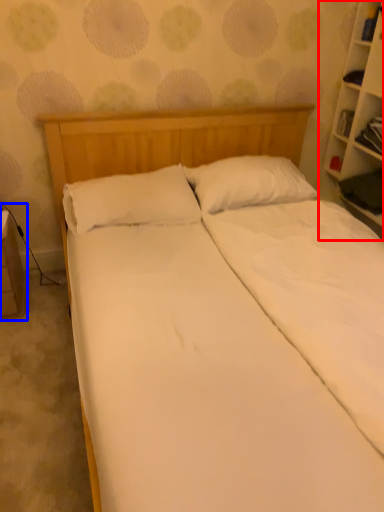
Question: Among these objects, which one is nearest to the camera, bookcase (highlighted by a red box) or table (highlighted by a blue box)?

Choices:
 (A) bookcase
 (B) table

Answer: (A)